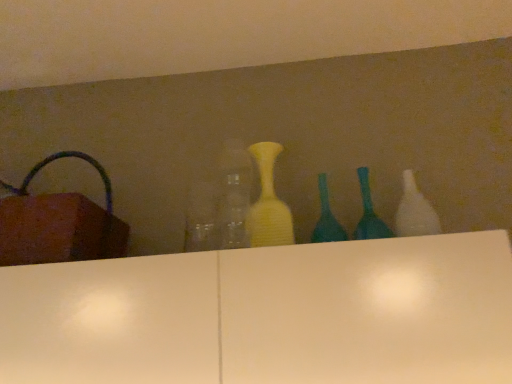
Question: Based on their sizes in the image, would you say teal glass bottle at center, which ranks as the fourth bottle in left-to-right order, is bigger or smaller than white glossy bottle at right, arranged as the 1th bottle when viewed from the right?

Choices:
 (A) big
 (B) small

Answer: (B)

Question: Is teal glass bottle at center, which ranks as the fourth bottle in left-to-right order, in front of or behind white glossy bottle at right, which is counted as the fifth bottle, starting from the left, in the image?

Choices:
 (A) front
 (B) behind

Answer: (B)

Question: Based on their relative distances, which object is nearer to the teal glass bottle at center, which ranks as the fourth bottle in left-to-right order?

Choices:
 (A) white glossy bottle at right, which is counted as the fifth bottle, starting from the left
 (B) teal glass bottle at center, which is the 3th bottle in right-to-left order
 (C) transparent glass bottle at center, which is the fifth bottle from right to left
 (D) yellow matte vase at center, the 4th bottle when ordered from right to left

Answer: (B)

Question: Which object is the closest to the teal glass bottle at center, placed as the second bottle when sorted from right to left?

Choices:
 (A) white glossy bottle at right, which is counted as the fifth bottle, starting from the left
 (B) transparent glass bottle at center, which is the fifth bottle from right to left
 (C) yellow matte vase at center, arranged as the 2th bottle when viewed from the left
 (D) teal glass bottle at center, the 3th bottle when ordered from left to right

Answer: (D)